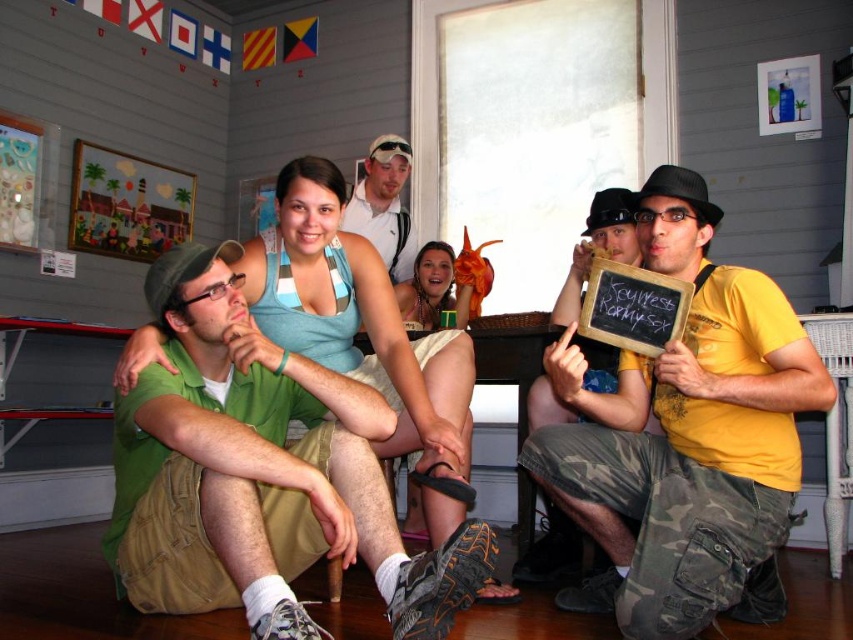
Question: Which point is closer to the camera?

Choices:
 (A) (648, 509)
 (B) (590, 260)

Answer: (A)

Question: Is yellow matte shirt at center below camouflage pants at lower right?

Choices:
 (A) yes
 (B) no

Answer: (A)

Question: In this image, where is black chalkboard at center located relative to white cotton shirt at upper center?

Choices:
 (A) right
 (B) left

Answer: (A)

Question: Which of these objects is positioned closest to the white cotton shirt at upper center?

Choices:
 (A) smooth tan skin at center
 (B) green cotton shirt at center

Answer: (A)

Question: Does yellow matte shirt at center appear over smooth tan skin at center?

Choices:
 (A) no
 (B) yes

Answer: (A)

Question: Which point appears farthest from the camera in this image?

Choices:
 (A) (706, 433)
 (B) (347, 504)

Answer: (A)